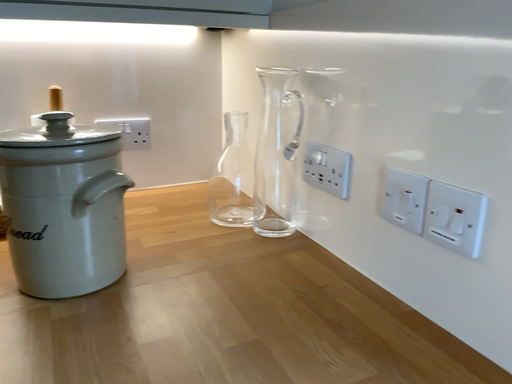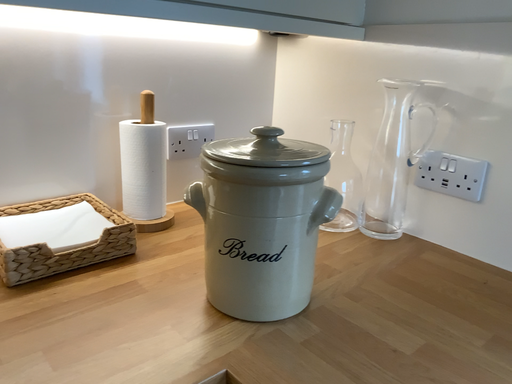
Question: How did the camera likely rotate when shooting the video?

Choices:
 (A) rotated right
 (B) rotated left

Answer: (A)